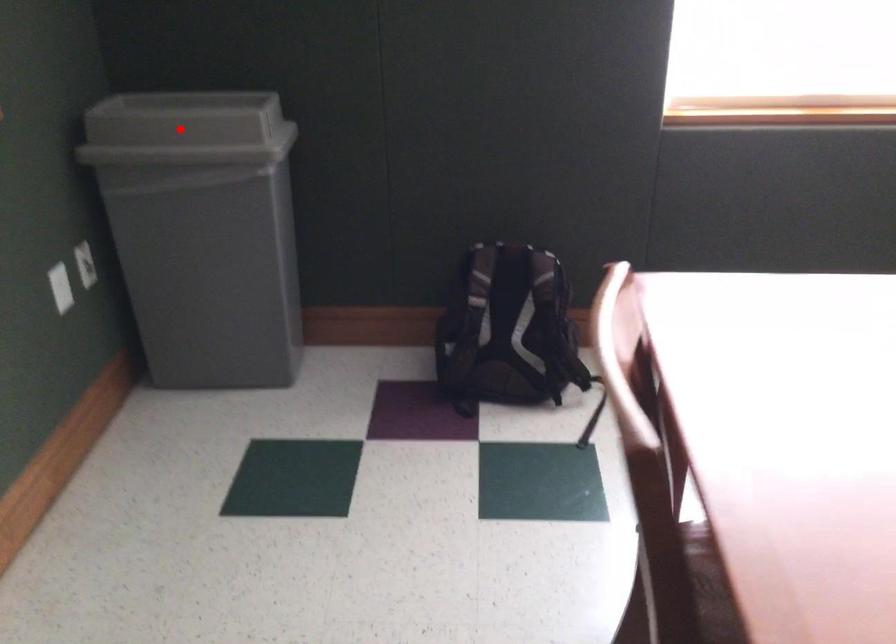
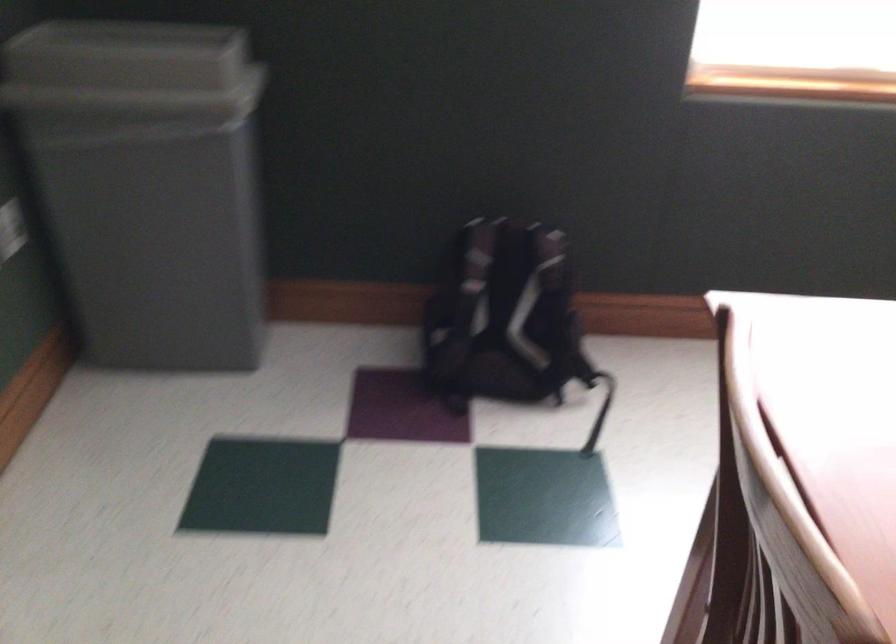
Locate, in the second image, the point that corresponds to the highlighted location in the first image.

(131, 71)